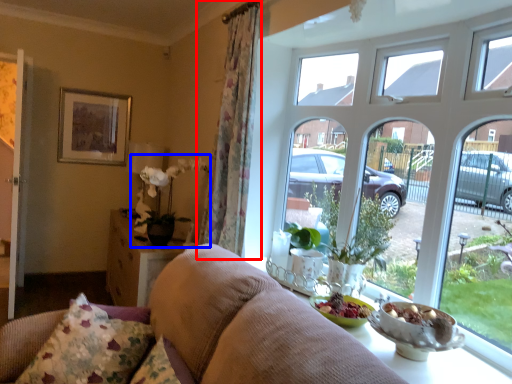
Question: Which of the following is the closest to the observer, curtain (highlighted by a red box) or floral arrangement (highlighted by a blue box)?

Choices:
 (A) curtain
 (B) floral arrangement

Answer: (A)